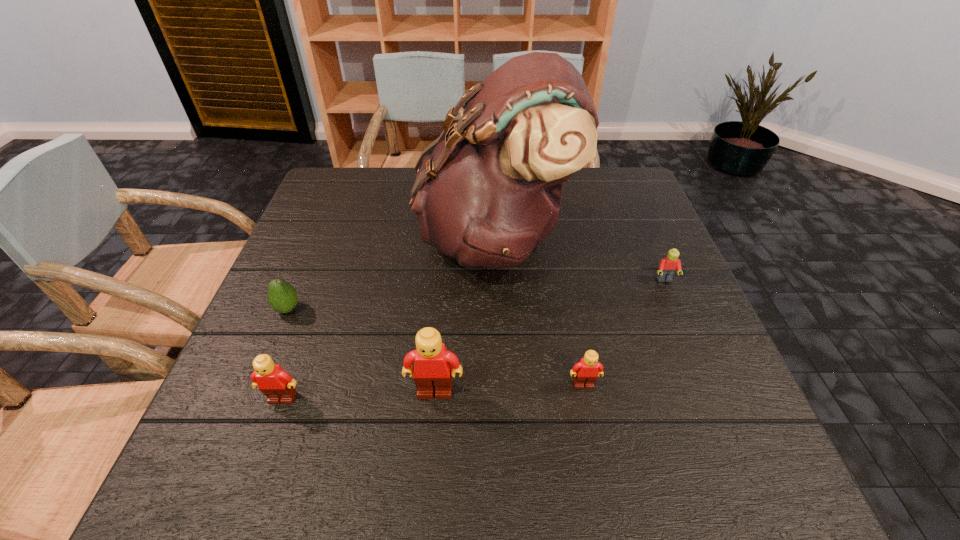
The width and height of the screenshot is (960, 540). Identify the location of vacant point located between the avocado and the satchel. (391, 274).

You are a GUI agent. You are given a task and a screenshot of the screen. Output one action in this format:
    pyautogui.click(x=<x>, y=<y>)
    Task: Click on the free space that is in between the avocado and the tallest object
    
    Given the screenshot: What is the action you would take?
    pyautogui.click(x=391, y=274)

The height and width of the screenshot is (540, 960). I want to click on free point between the rightmost object and the second tallest object, so click(x=550, y=336).

You are a GUI agent. You are given a task and a screenshot of the screen. Output one action in this format:
    pyautogui.click(x=<x>, y=<y>)
    Task: Click on the vacant space in between the avocado and the tallest object
    The height and width of the screenshot is (540, 960).
    Given the screenshot: What is the action you would take?
    pyautogui.click(x=391, y=274)

Locate which object ranks in proximity to the tallest object. Please provide its 2D coordinates. Your answer should be formatted as a tuple, i.e. [(x, y)], where the tuple contains the x and y coordinates of a point satisfying the conditions above.

[(667, 268)]

Find the location of a particular element. object that stands as the fourth closest to the satchel is located at coordinates (282, 296).

Find the location of a particular element. This screenshot has height=540, width=960. Lego that is the second closest to the satchel is located at coordinates (586, 372).

Identify which Lego is located as the second nearest to the second Lego from left to right. Please provide its 2D coordinates. Your answer should be formatted as a tuple, i.e. [(x, y)], where the tuple contains the x and y coordinates of a point satisfying the conditions above.

[(586, 372)]

The width and height of the screenshot is (960, 540). Identify the location of vacant position in the image that satisfies the following two spatial constraints: 1. at the front of the satchel with buckles; 2. on the face of the second Lego from left to right. (499, 392).

This screenshot has height=540, width=960. I want to click on free space that satisfies the following two spatial constraints: 1. at the front of the satchel with buckles; 2. on the face of the second tallest object, so click(x=499, y=392).